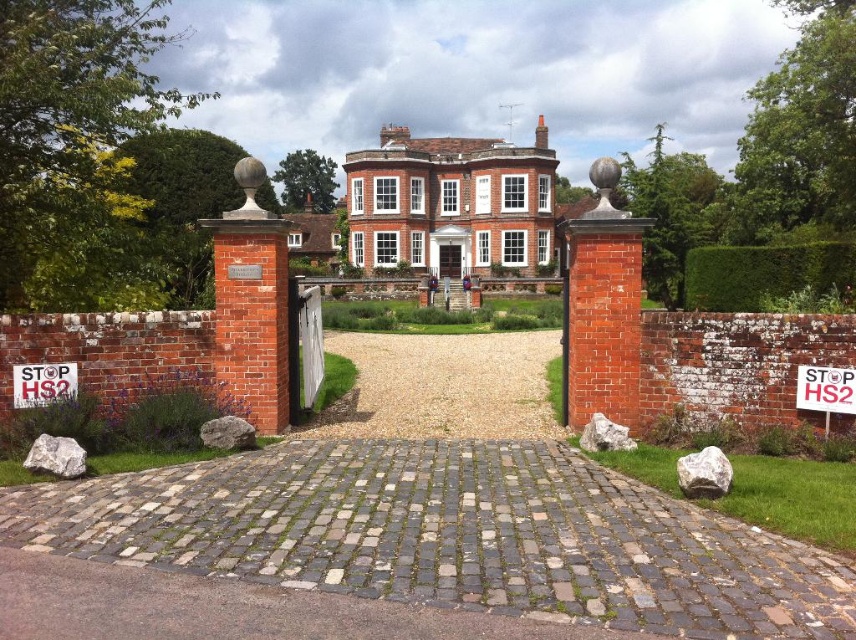
You are standing at the front entrance of the house and want to place a decorative stone exactly at the center of the gravel at center. According to the image, what are the coordinates where you should place the stone?

The coordinates for the gravel at center are at point [443,387], so you should place the decorative stone there.

You are a delivery driver approaching the house and need to park your vehicle. The gravel at center and the white paper sign at center are in your path. Which object will you need to avoid hitting first as you drive forward?

The white paper sign at center is shorter than the gravel at center, so you will hit the white paper sign at center first as it is lower and in your path.

You are a pedestrian standing at the edge of the gray cobblestone driveway at center, facing the house. You want to walk to the green leafy hedge at right. Which direction should you turn to reach it?

The green leafy hedge at right is located to the right side of the gray cobblestone driveway at center, so you should turn right to reach it.